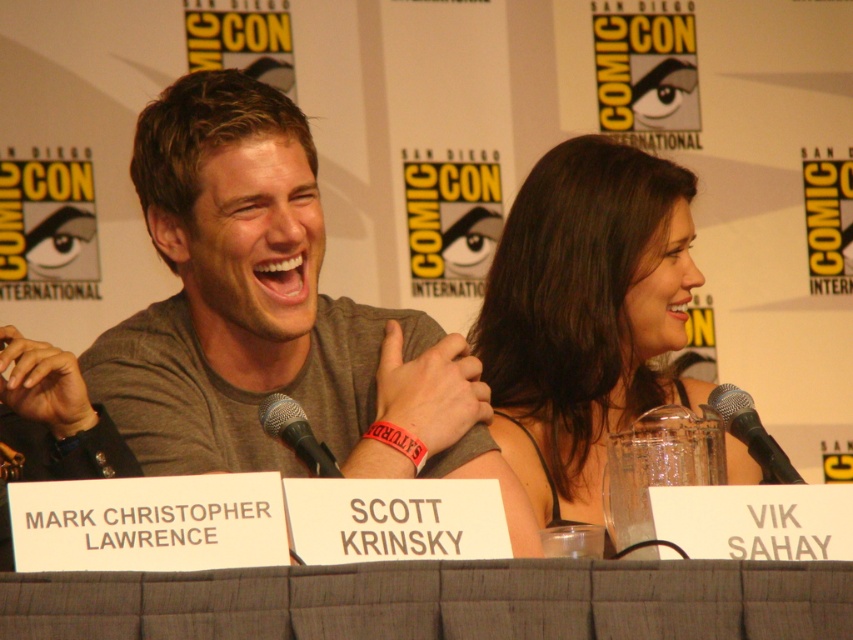
You are attending the Comic Con panel and want to take a photo of the gray cotton shirt at center. Where should you position yourself to capture it in the best possible view?

The gray cotton shirt at center is located at point (274, 316), so positioning yourself directly in front of that coordinate will provide the best view.